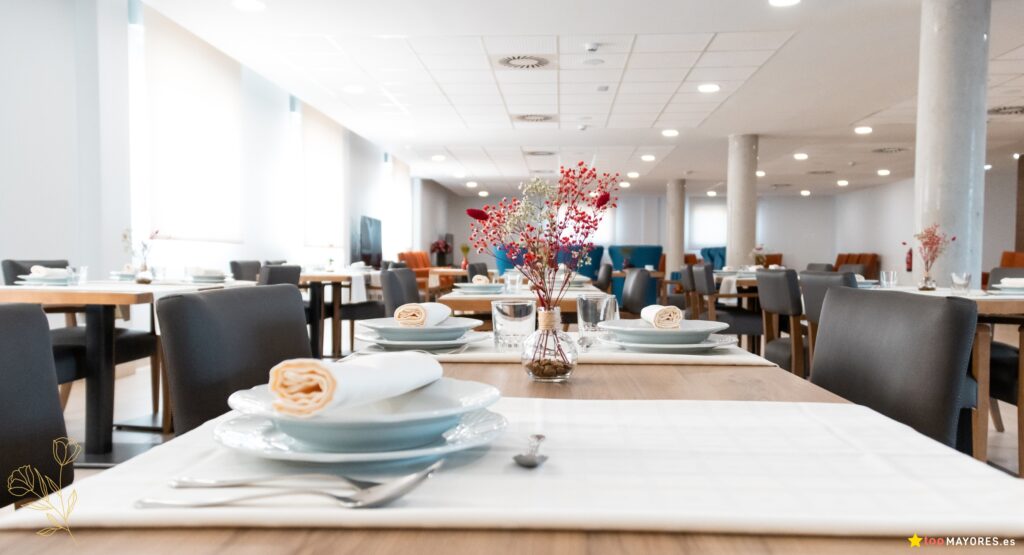
In order to click on visible glassware in this screenshot , I will do `click(512, 325)`, `click(595, 310)`, `click(73, 273)`, `click(512, 280)`, `click(891, 278)`, `click(952, 279)`.